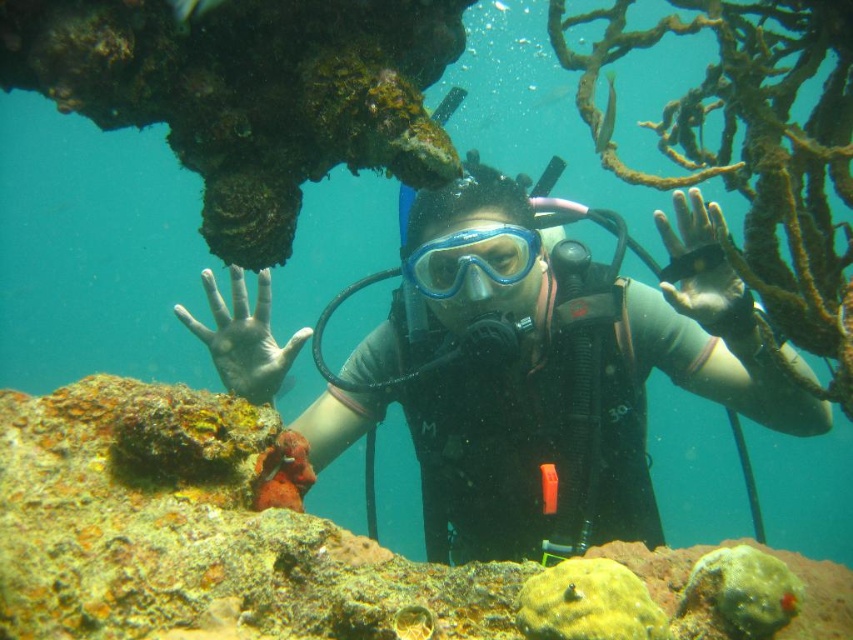
Question: Does matte rubber hand at center appear under blue matte/glass goggles at center?

Choices:
 (A) no
 (B) yes

Answer: (B)

Question: Which point is closer to the camera?

Choices:
 (A) matte black scuba diver at center
 (B) matte rubber hand at center
 (C) black matte glove at center

Answer: (C)

Question: Estimate the real-world distances between objects in this image. Which object is farther from the matte black scuba diver at center?

Choices:
 (A) yellow coral at center
 (B) black matte glove at center

Answer: (A)

Question: Does matte black scuba diver at center have a lesser width compared to blue matte/glass goggles at center?

Choices:
 (A) no
 (B) yes

Answer: (A)

Question: Which object is positioned closest to the matte rubber hand at center?

Choices:
 (A) black matte glove at center
 (B) matte black scuba diver at center
 (C) blue matte/glass goggles at center

Answer: (C)

Question: Is matte rubber hand at center smaller than blue matte/glass goggles at center?

Choices:
 (A) no
 (B) yes

Answer: (A)